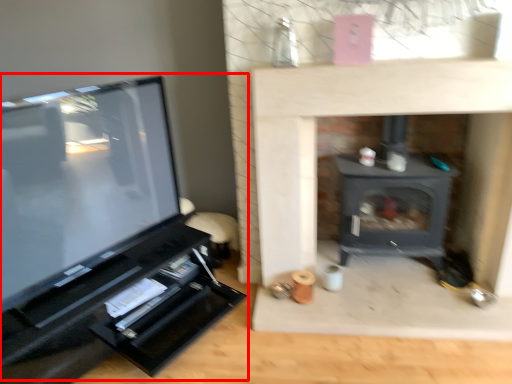
Question: From the image, what is the correct spatial relationship of entertainment center (annotated by the red box) in relation to wood burning stove?

Choices:
 (A) right
 (B) left

Answer: (B)